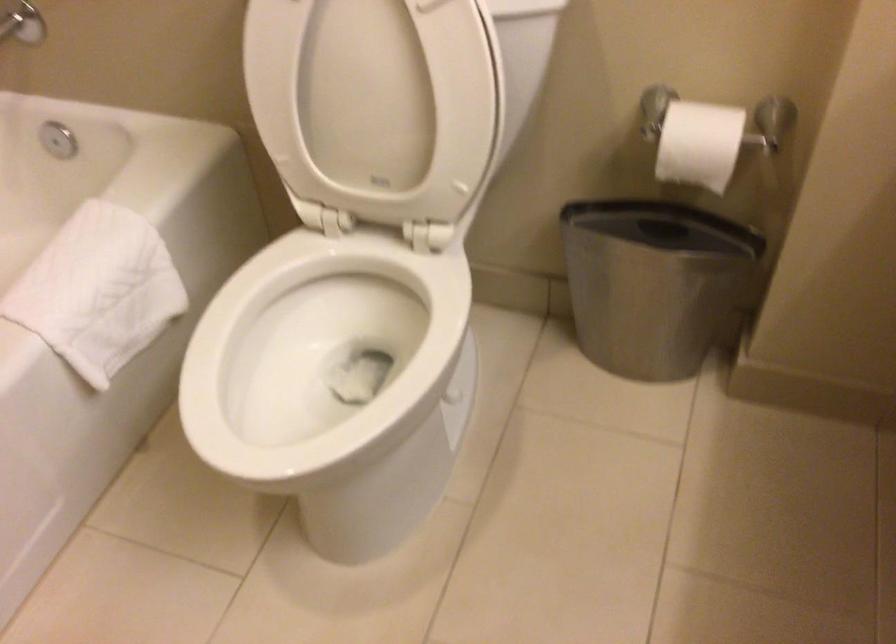
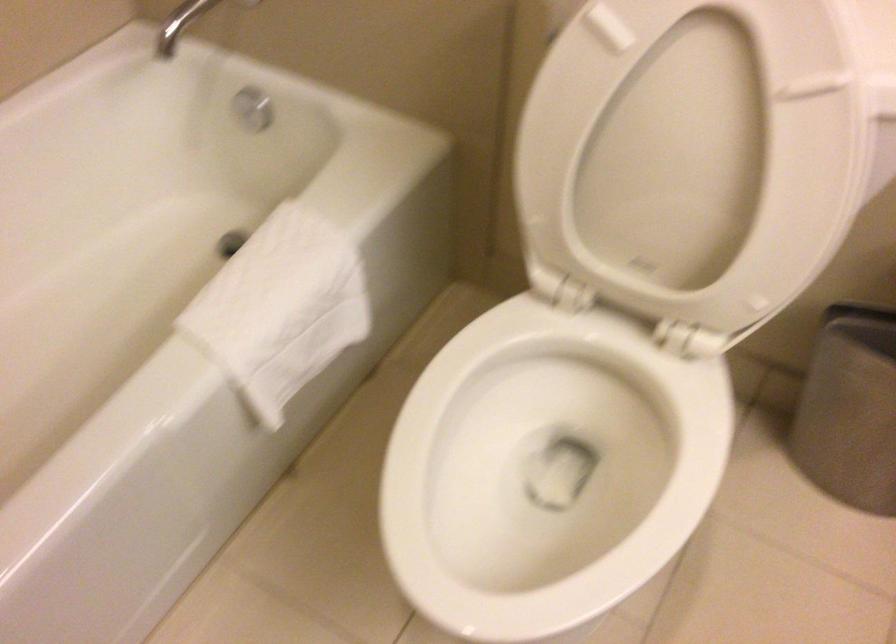
Find the pixel in the second image that matches the point at 381,78 in the first image.

(691, 154)